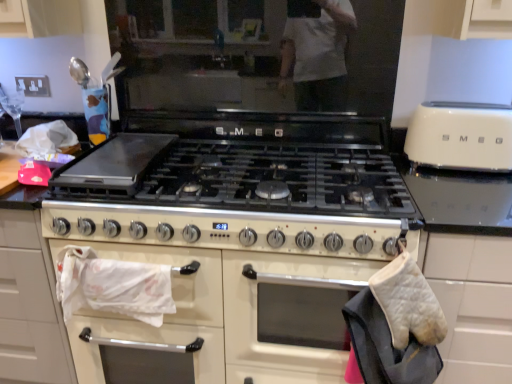
Question: Can you confirm if white glossy oven at center is shorter than white quilted oven mitt at right?

Choices:
 (A) no
 (B) yes

Answer: (A)

Question: From a real-world perspective, is white glossy oven at center below white quilted oven mitt at right?

Choices:
 (A) no
 (B) yes

Answer: (B)

Question: Does white glossy oven at center appear on the right side of white quilted oven mitt at right?

Choices:
 (A) yes
 (B) no

Answer: (B)

Question: Is white quilted oven mitt at right located within white glossy oven at center?

Choices:
 (A) yes
 (B) no

Answer: (B)

Question: Is white glossy oven at center aimed at white quilted oven mitt at right?

Choices:
 (A) yes
 (B) no

Answer: (A)

Question: From the image's perspective, is white glossy oven at center above white quilted oven mitt at right?

Choices:
 (A) yes
 (B) no

Answer: (B)

Question: Is white glossy oven at center closer to camera compared to ivory matte toaster at right?

Choices:
 (A) no
 (B) yes

Answer: (B)

Question: From a real-world perspective, is white glossy oven at center on ivory matte toaster at right?

Choices:
 (A) yes
 (B) no

Answer: (B)

Question: Can you confirm if white glossy oven at center is bigger than ivory matte toaster at right?

Choices:
 (A) no
 (B) yes

Answer: (B)

Question: Is ivory matte toaster at right surrounded by white glossy oven at center?

Choices:
 (A) yes
 (B) no

Answer: (B)

Question: From a real-world perspective, is white glossy oven at center under ivory matte toaster at right?

Choices:
 (A) no
 (B) yes

Answer: (B)

Question: Is white glossy oven at center further to the viewer compared to ivory matte toaster at right?

Choices:
 (A) yes
 (B) no

Answer: (B)

Question: From a real-world perspective, is white quilted oven mitt at right beneath white glossy oven at center?

Choices:
 (A) yes
 (B) no

Answer: (B)